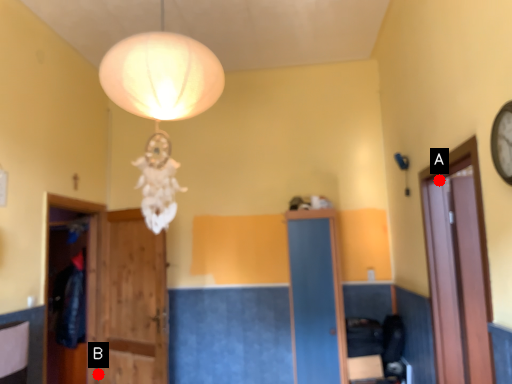
Question: Two points are circled on the image, labeled by A and B beside each circle. Which point is farther from the camera taking this photo?

Choices:
 (A) A is further
 (B) B is further

Answer: (B)